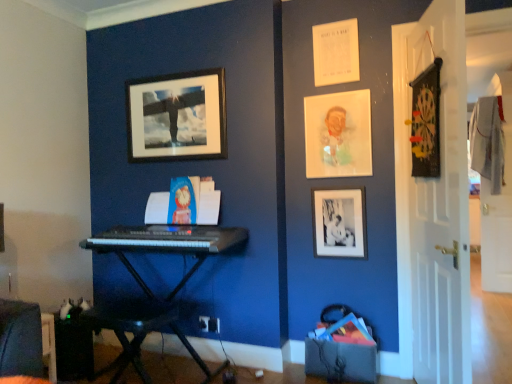
Question: Is velvet dark blue swivel chair at lower left thinner than black matte picture frame at upper center, arranged as the 1th picture frame when viewed from the left?

Choices:
 (A) no
 (B) yes

Answer: (A)

Question: Is velvet dark blue swivel chair at lower left not near black matte picture frame at upper center, arranged as the 1th picture frame when viewed from the left?

Choices:
 (A) yes
 (B) no

Answer: (A)

Question: From a real-world perspective, is velvet dark blue swivel chair at lower left positioned over black matte picture frame at upper center, the 3th picture frame from the right, based on gravity?

Choices:
 (A) no
 (B) yes

Answer: (A)

Question: From the image's perspective, is velvet dark blue swivel chair at lower left below black matte picture frame at upper center, the 3th picture frame from the right?

Choices:
 (A) no
 (B) yes

Answer: (B)

Question: Does velvet dark blue swivel chair at lower left lie behind black matte picture frame at upper center, the 3th picture frame from the right?

Choices:
 (A) no
 (B) yes

Answer: (A)

Question: Would you say black matte picture frame at upper center, the 3th picture frame from the right, is to the left or to the right of velvet dark blue swivel chair at lower left in the picture?

Choices:
 (A) right
 (B) left

Answer: (A)

Question: From the image's perspective, is black matte picture frame at upper center, arranged as the 1th picture frame when viewed from the left, above or below velvet dark blue swivel chair at lower left?

Choices:
 (A) below
 (B) above

Answer: (B)

Question: Is point (217, 82) positioned closer to the camera than point (29, 314)?

Choices:
 (A) closer
 (B) farther

Answer: (B)

Question: In terms of size, does black matte picture frame at upper center, the 3th picture frame from the right, appear bigger or smaller than velvet dark blue swivel chair at lower left?

Choices:
 (A) big
 (B) small

Answer: (B)

Question: From the image's perspective, is white wood door at right, arranged as the 2th door when viewed from the front, located above or below velvet dark blue swivel chair at lower left?

Choices:
 (A) above
 (B) below

Answer: (A)

Question: Relative to velvet dark blue swivel chair at lower left, is white wood door at right, which is the 1th door from back to front, in front or behind?

Choices:
 (A) front
 (B) behind

Answer: (B)

Question: In terms of width, does white wood door at right, which is the 1th door from back to front, look wider or thinner when compared to velvet dark blue swivel chair at lower left?

Choices:
 (A) wide
 (B) thin

Answer: (B)

Question: Does point (490, 243) appear closer or farther from the camera than point (15, 327)?

Choices:
 (A) farther
 (B) closer

Answer: (A)

Question: From their relative heights in the image, would you say velvet dark blue swivel chair at lower left is taller or shorter than matte plastic portrait at upper right, the 2th picture frame in the left-to-right sequence?

Choices:
 (A) tall
 (B) short

Answer: (B)

Question: Is velvet dark blue swivel chair at lower left spatially inside matte plastic portrait at upper right, the 2th picture frame in the left-to-right sequence, or outside of it?

Choices:
 (A) inside
 (B) outside

Answer: (B)